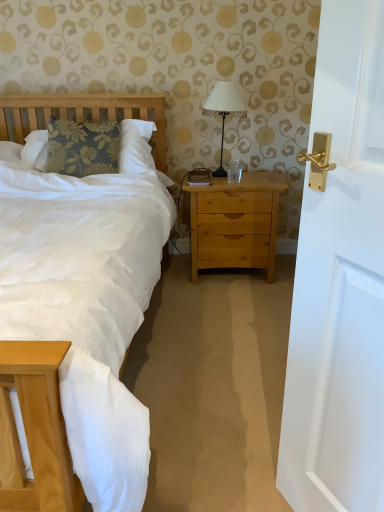
Question: Is light brown wood nightstand at center wider or thinner than white fabric-covered lamp at upper center?

Choices:
 (A) thin
 (B) wide

Answer: (B)

Question: From the image's perspective, is light brown wood nightstand at center above or below white fabric-covered lamp at upper center?

Choices:
 (A) below
 (B) above

Answer: (A)

Question: Is light brown wood nightstand at center taller or shorter than white fabric-covered lamp at upper center?

Choices:
 (A) short
 (B) tall

Answer: (B)

Question: From the image's perspective, is white fabric-covered lamp at upper center located above or below light brown wood nightstand at center?

Choices:
 (A) below
 (B) above

Answer: (B)

Question: Based on their positions, is white fabric-covered lamp at upper center located to the left or right of light brown wood nightstand at center?

Choices:
 (A) right
 (B) left

Answer: (B)

Question: Considering their positions, is white fabric-covered lamp at upper center located in front of or behind light brown wood nightstand at center?

Choices:
 (A) behind
 (B) front

Answer: (B)

Question: Looking at their shapes, would you say white fabric-covered lamp at upper center is wider or thinner than light brown wood nightstand at center?

Choices:
 (A) thin
 (B) wide

Answer: (A)